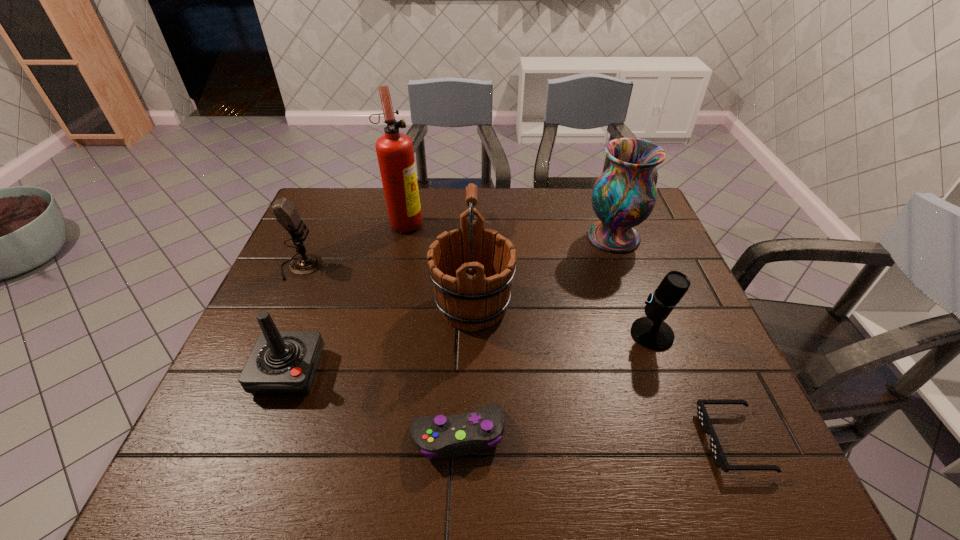
What are the coordinates of `free space between the joystick and the nearer microphone` in the screenshot? It's located at (470, 353).

Locate an element on the screen. Image resolution: width=960 pixels, height=540 pixels. free space between the right microphone and the joystick is located at coordinates (470, 353).

Locate which object ranks third in proximity to the wine bucket. Please provide its 2D coordinates. Your answer should be formatted as a tuple, i.e. [(x, y)], where the tuple contains the x and y coordinates of a point satisfying the conditions above.

[(282, 363)]

Locate which object is the second closest to the vase. Please provide its 2D coordinates. Your answer should be formatted as a tuple, i.e. [(x, y)], where the tuple contains the x and y coordinates of a point satisfying the conditions above.

[(472, 269)]

At what (x,y) coordinates should I click in order to perform the action: click on free space that satisfies the following two spatial constraints: 1. on the front-facing side of the control; 2. on the left side of the joystick. Please return your answer as a coordinate pair (x, y). The image size is (960, 540). Looking at the image, I should click on (265, 435).

What are the coordinates of `free location that satisfies the following two spatial constraints: 1. on the front-facing side of the joystick; 2. on the right side of the control` in the screenshot? It's located at (265, 435).

The width and height of the screenshot is (960, 540). What are the coordinates of `vacant space that satisfies the following two spatial constraints: 1. on the front-facing side of the fire extinguisher; 2. on the left side of the sixth shortest object` in the screenshot? It's located at (403, 237).

Find the location of a particular element. This screenshot has height=540, width=960. blank area in the image that satisfies the following two spatial constraints: 1. on the front-facing side of the farther microphone; 2. on the left side of the right microphone is located at coordinates (271, 334).

Identify the location of free spot that satisfies the following two spatial constraints: 1. on the front-facing side of the seventh tallest object; 2. on the left side of the joystick. (x=265, y=435).